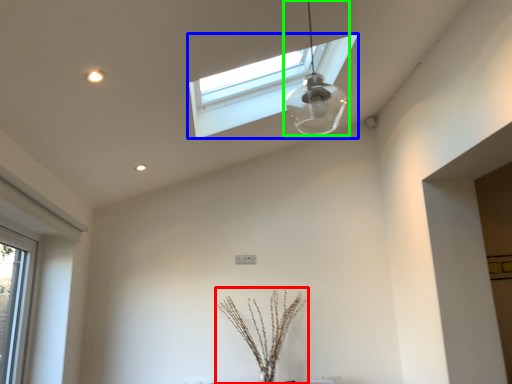
Question: Considering the real-world distances, which object is closest to plant (highlighted by a red box)? window (highlighted by a blue box) or lamp (highlighted by a green box).

Choices:
 (A) window
 (B) lamp

Answer: (B)